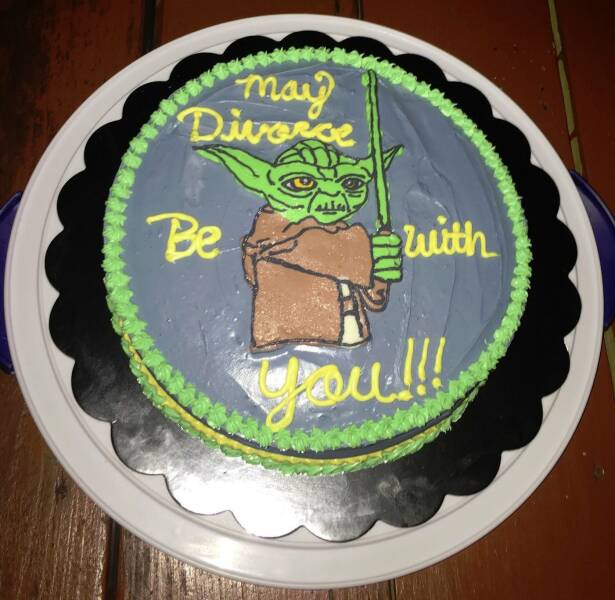
Image resolution: width=615 pixels, height=600 pixels. I want to click on table, so click(x=88, y=50).